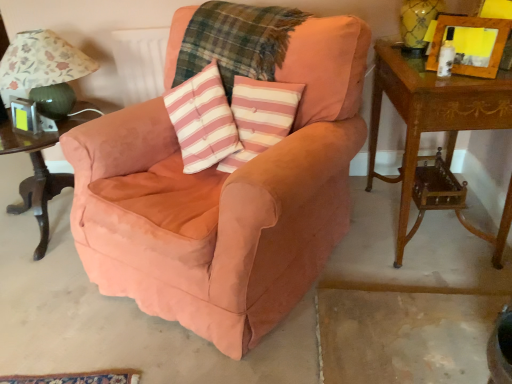
Question: Does floral fabric lampshade at left have a larger size compared to wooden carved side table at right, the first table viewed from the right?

Choices:
 (A) no
 (B) yes

Answer: (A)

Question: Would you say floral fabric lampshade at left contains wooden carved side table at right, the first table viewed from the right?

Choices:
 (A) no
 (B) yes

Answer: (A)

Question: From the image's perspective, is floral fabric lampshade at left under wooden carved side table at right, arranged as the 2th table when viewed from the left?

Choices:
 (A) yes
 (B) no

Answer: (B)

Question: From a real-world perspective, is floral fabric lampshade at left located beneath wooden carved side table at right, the first table viewed from the right?

Choices:
 (A) yes
 (B) no

Answer: (B)

Question: Does floral fabric lampshade at left touch wooden carved side table at right, the first table viewed from the right?

Choices:
 (A) yes
 (B) no

Answer: (B)

Question: Which is correct: plaid fabric at center is inside pink striped fabric pillow at center, or outside of it?

Choices:
 (A) inside
 (B) outside

Answer: (B)

Question: Considering their positions, is plaid fabric at center located in front of or behind pink striped fabric pillow at center?

Choices:
 (A) front
 (B) behind

Answer: (B)

Question: In terms of height, does plaid fabric at center look taller or shorter compared to pink striped fabric pillow at center?

Choices:
 (A) short
 (B) tall

Answer: (B)

Question: Is plaid fabric at center wider or thinner than pink striped fabric pillow at center?

Choices:
 (A) thin
 (B) wide

Answer: (B)

Question: Does point (40, 74) appear closer or farther from the camera than point (285, 99)?

Choices:
 (A) farther
 (B) closer

Answer: (A)

Question: Is floral fabric lampshade at left wider or thinner than pink striped fabric pillow at center?

Choices:
 (A) thin
 (B) wide

Answer: (B)

Question: Is floral fabric lampshade at left spatially inside pink striped fabric pillow at center, or outside of it?

Choices:
 (A) inside
 (B) outside

Answer: (B)

Question: Considering their positions, is floral fabric lampshade at left located in front of or behind pink striped fabric pillow at center?

Choices:
 (A) behind
 (B) front

Answer: (A)

Question: Considering the positions of wooden carved side table at right, arranged as the 2th table when viewed from the left, and metallic silver picture frame at left, the 1th picture frame in the left-to-right sequence, in the image, is wooden carved side table at right, arranged as the 2th table when viewed from the left, bigger or smaller than metallic silver picture frame at left, the 1th picture frame in the left-to-right sequence,?

Choices:
 (A) big
 (B) small

Answer: (A)

Question: From their relative heights in the image, would you say wooden carved side table at right, arranged as the 2th table when viewed from the left, is taller or shorter than metallic silver picture frame at left, acting as the second picture frame starting from the front?

Choices:
 (A) short
 (B) tall

Answer: (B)